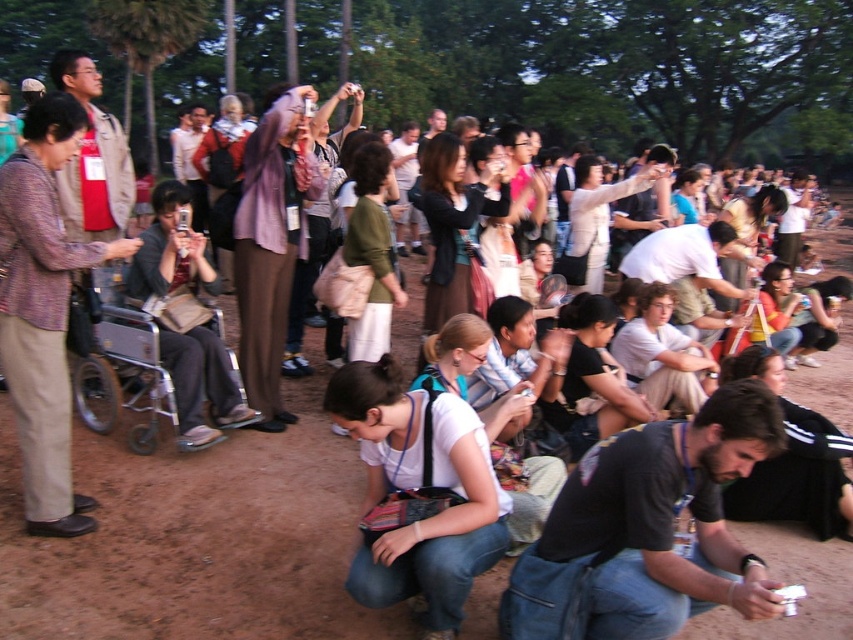
You are organizing a clothing donation drive and need to categorize shirts based on their size. You have two shirts in front of you from the image described. The dark gray fabric shirt at lower right and the white fabric shirt at center. Which shirt should you place in the larger size bin?

The dark gray fabric shirt at lower right should be placed in the larger size bin because its width is larger than the white fabric shirt at center.